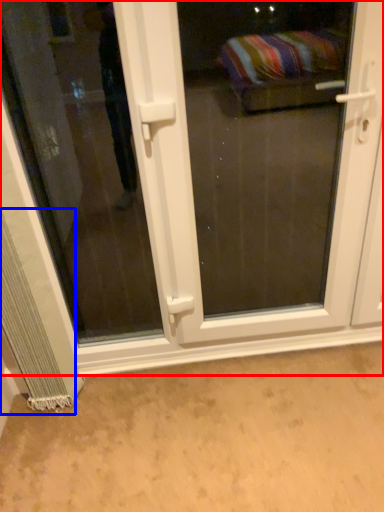
Question: Which of the following is the closest to the observer, door (highlighted by a red box) or curtain (highlighted by a blue box)?

Choices:
 (A) door
 (B) curtain

Answer: (A)